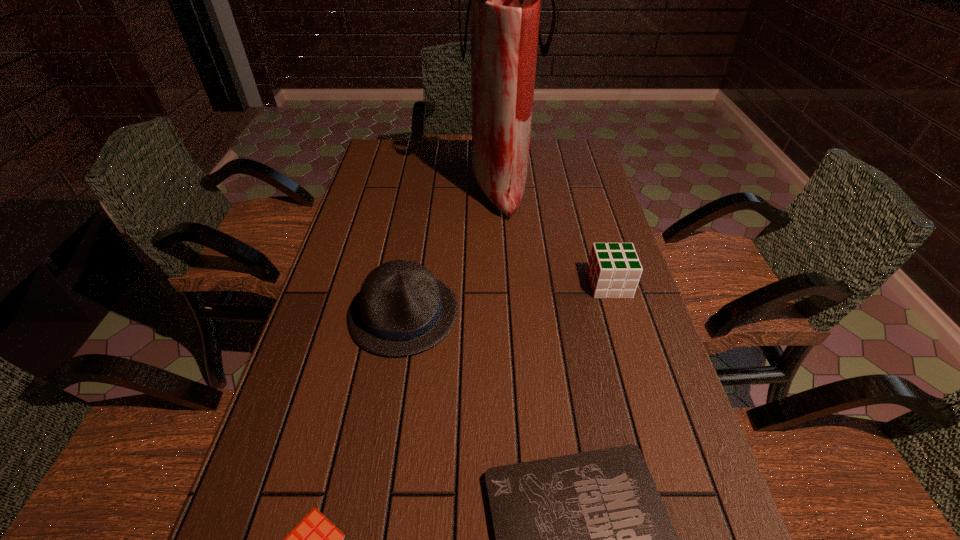
Identify which object is the closest to the left cube. Please provide its 2D coordinates. Your answer should be formatted as a tuple, i.e. [(x, y)], where the tuple contains the x and y coordinates of a point satisfying the conditions above.

[(585, 539)]

Where is `free space in the image that satisfies the following two spatial constraints: 1. on the red face of the right cube; 2. on the front-facing side of the bowler hat`? The height and width of the screenshot is (540, 960). free space in the image that satisfies the following two spatial constraints: 1. on the red face of the right cube; 2. on the front-facing side of the bowler hat is located at coordinates (618, 314).